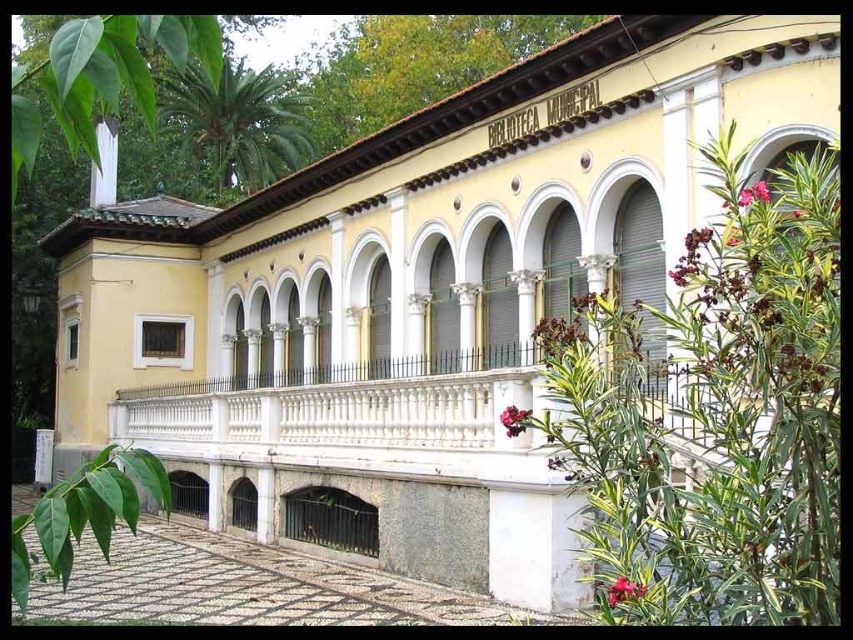
Question: Does pink matte flower at lower right appear over pink matte flower at center?

Choices:
 (A) yes
 (B) no

Answer: (B)

Question: Which object is positioned farthest from the pink matte flower at lower right?

Choices:
 (A) pink matte flower at center
 (B) gray concrete courtyard at lower center

Answer: (B)

Question: Estimate the real-world distances between objects in this image. Which object is farther from the gray concrete courtyard at lower center?

Choices:
 (A) pink matte flower at lower right
 (B) pink matte flower at center

Answer: (A)

Question: Which object is farther from the camera taking this photo?

Choices:
 (A) gray concrete courtyard at lower center
 (B) pink matte flower at lower right
 (C) pink matte flower at center

Answer: (A)

Question: Does gray concrete courtyard at lower center have a larger size compared to pink matte flower at center?

Choices:
 (A) no
 (B) yes

Answer: (B)

Question: Is gray concrete courtyard at lower center to the right of pink matte flower at lower right from the viewer's perspective?

Choices:
 (A) no
 (B) yes

Answer: (A)